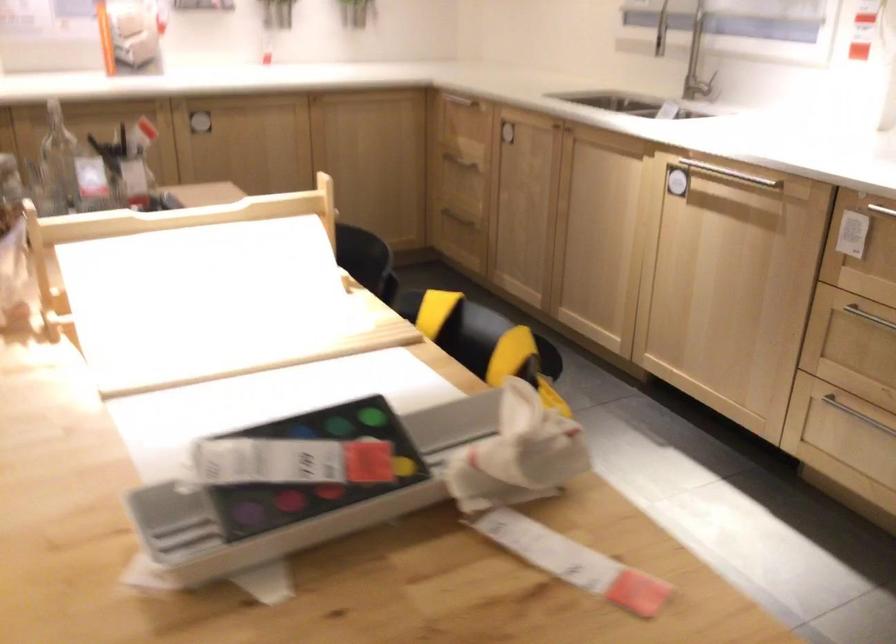
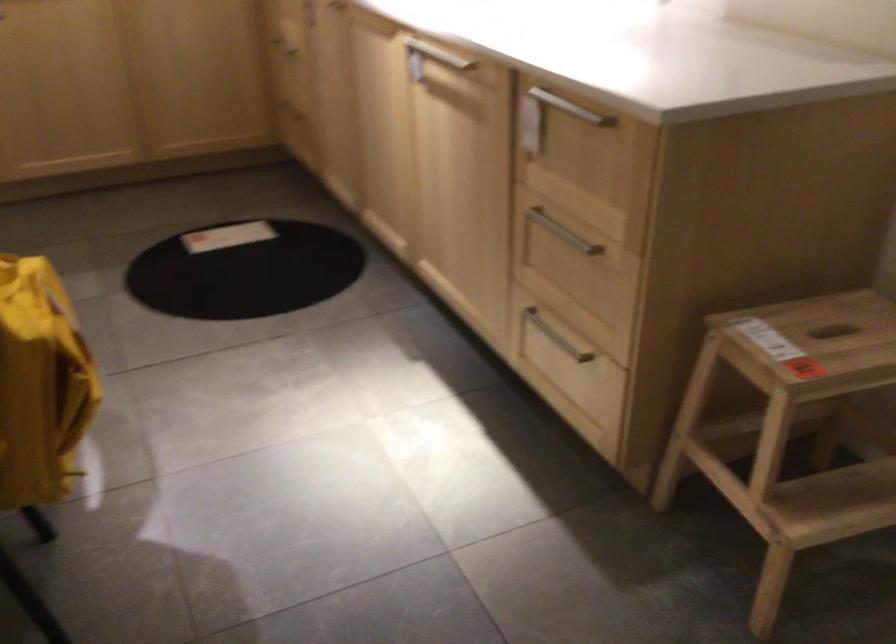
In the second image, find the point that corresponds to the point at 692,169 in the first image.

(428, 59)